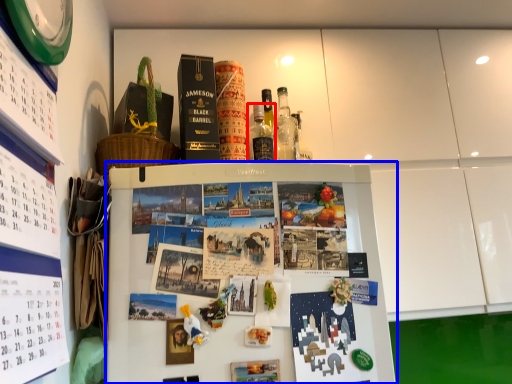
Question: Which of the following is the closest to the observer, bottle (highlighted by a red box) or refrigerator (highlighted by a blue box)?

Choices:
 (A) bottle
 (B) refrigerator

Answer: (B)